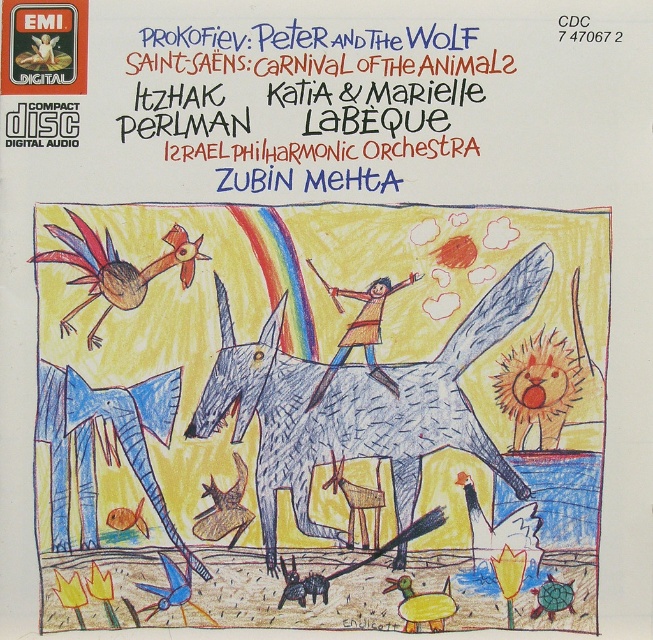
Question: Does blue ink text at upper center have a larger size compared to colored pencil rooster at upper left?

Choices:
 (A) yes
 (B) no

Answer: (A)

Question: Is gray scribbled donkey at center thinner than blue crayon elephant at lower left?

Choices:
 (A) no
 (B) yes

Answer: (A)

Question: Does blue ink text at upper center lie in front of gray scribbled donkey at center?

Choices:
 (A) yes
 (B) no

Answer: (B)

Question: Which object is farther from the camera taking this photo?

Choices:
 (A) colored pencil rooster at upper left
 (B) blue crayon elephant at lower left

Answer: (A)

Question: Which of the following is the closest to the observer?

Choices:
 (A) colored pencil rooster at upper left
 (B) gray scribbled donkey at center

Answer: (B)

Question: Estimate the real-world distances between objects in this image. Which object is closer to the gray scribbled donkey at center?

Choices:
 (A) colored pencil rooster at upper left
 (B) blue crayon elephant at lower left
 (C) blue ink text at upper center

Answer: (B)